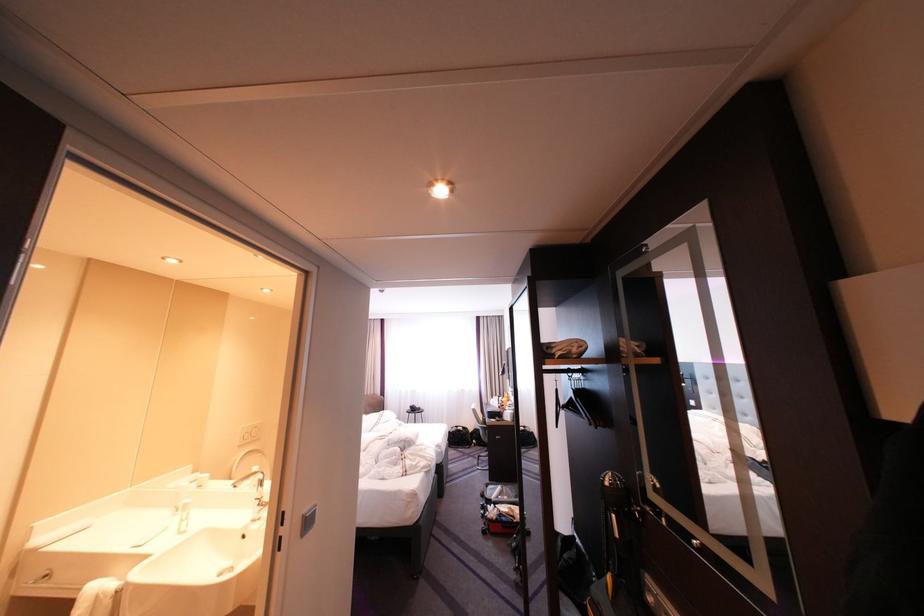
What do you see at coordinates (260, 496) in the screenshot? Image resolution: width=924 pixels, height=616 pixels. I see `the chrome faucet handle` at bounding box center [260, 496].